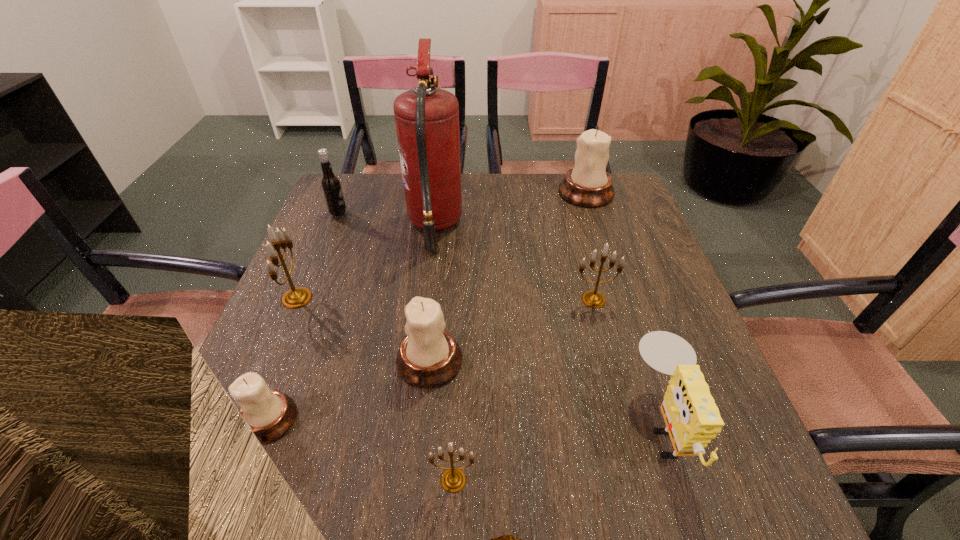
Identify the location of vacant area in the image that satisfies the following two spatial constraints: 1. on the back side of the rightmost gold candelabrum; 2. on the label of the root beer. Image resolution: width=960 pixels, height=540 pixels. (571, 214).

At what (x,y) coordinates should I click in order to perform the action: click on vacant area in the image that satisfies the following two spatial constraints: 1. on the back side of the biggest white candle holder; 2. on the left side of the smallest gold candelabrum. Please return your answer as a coordinate pair (x, y). Looking at the image, I should click on (466, 193).